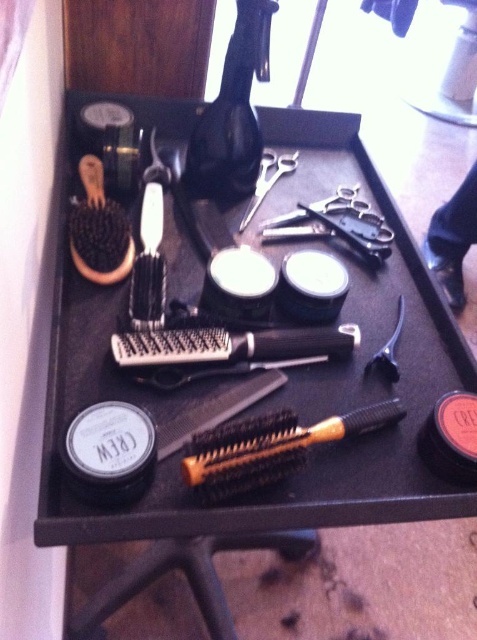
Does gold-bristled brush at center have a greater width compared to black plastic comb at center?

In fact, gold-bristled brush at center might be narrower than black plastic comb at center.

Is gold-bristled brush at center thinner than black plastic comb at center?

Correct, gold-bristled brush at center's width is less than black plastic comb at center's.

Locate an element on the screen. The height and width of the screenshot is (640, 477). gold-bristled brush at center is located at coordinates (269, 448).